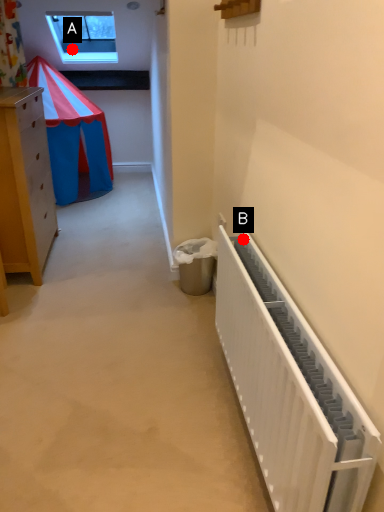
Question: Two points are circled on the image, labeled by A and B beside each circle. Which of the following is the farthest from the observer?

Choices:
 (A) A is further
 (B) B is further

Answer: (A)